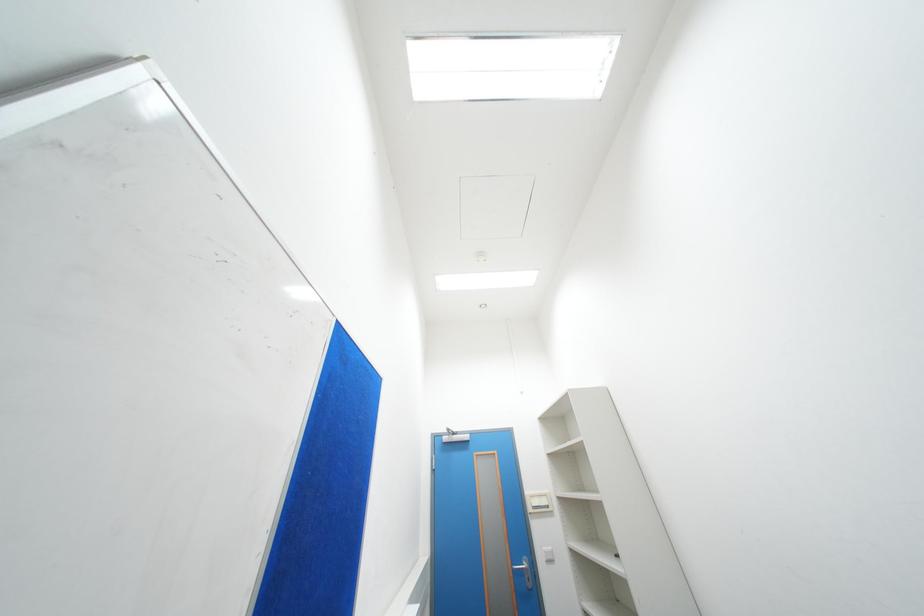
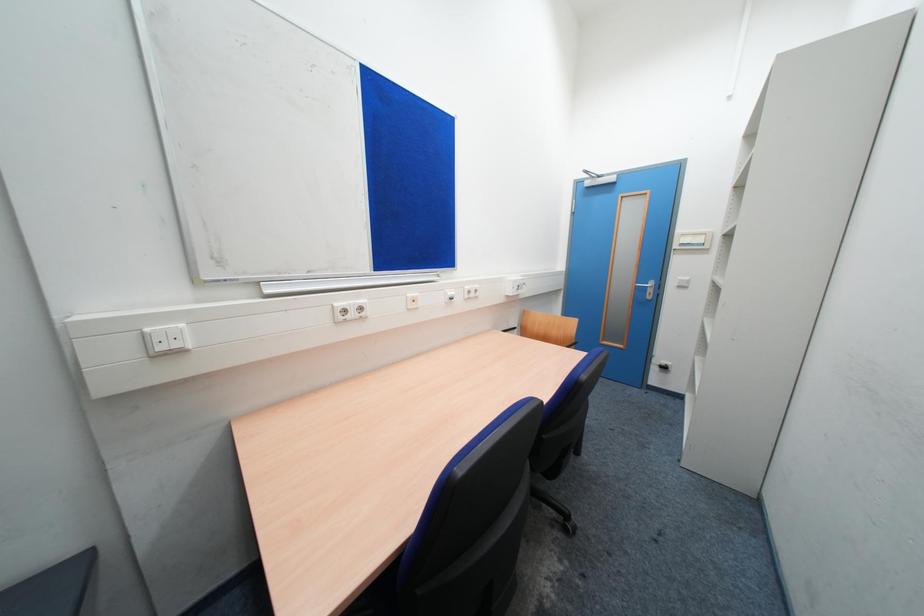
The images are taken continuously from a first-person perspective. In which direction is your viewpoint rotating?

The rotation direction of the camera is left-down.